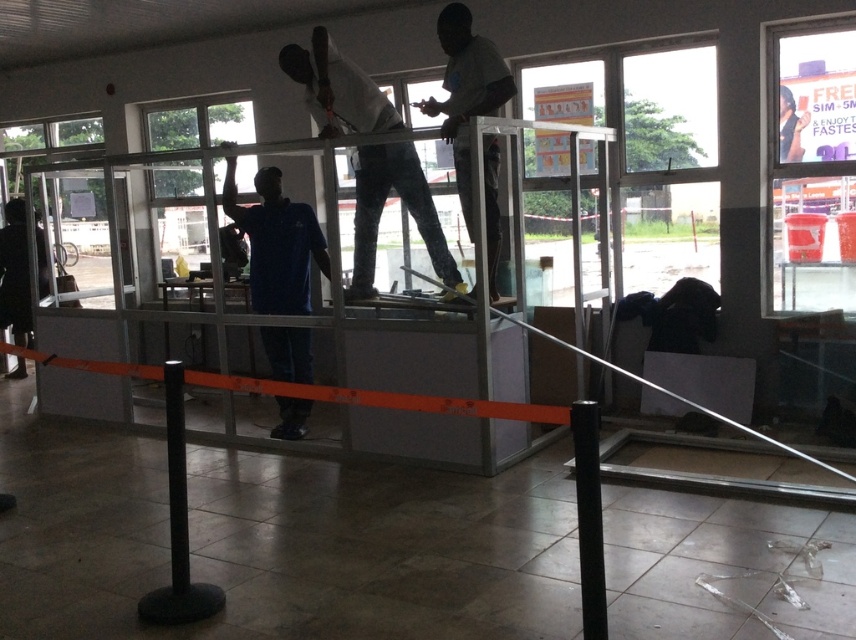
Is transparent glass window at upper right positioned at the back of white matte shirt at upper center?

Yes, it is behind white matte shirt at upper center.

At what (x,y) coordinates should I click in order to perform the action: click on transparent glass window at upper right. Please return your answer as a coordinate pair (x, y). The width and height of the screenshot is (856, 640). Looking at the image, I should click on (811, 164).

You are a GUI agent. You are given a task and a screenshot of the screen. Output one action in this format:
    pyautogui.click(x=<x>, y=<y>)
    Task: Click on the transparent glass window at upper right
    The width and height of the screenshot is (856, 640).
    Given the screenshot: What is the action you would take?
    pyautogui.click(x=811, y=164)

Who is positioned more to the left, light blue shirt at center or white matte shirt at upper center?

From the viewer's perspective, light blue shirt at center appears more on the left side.

What are the coordinates of `light blue shirt at center` in the screenshot? It's located at (381, 211).

The width and height of the screenshot is (856, 640). Describe the element at coordinates (381, 211) in the screenshot. I see `light blue shirt at center` at that location.

Where is `light blue shirt at center`? The width and height of the screenshot is (856, 640). light blue shirt at center is located at coordinates (381, 211).

Based on the photo, does white matte shirt at upper center appear on the left side of black rubber pole at lower left?

In fact, white matte shirt at upper center is to the right of black rubber pole at lower left.

Which is behind, point (495, 102) or point (169, 422)?

The point (495, 102) is behind.

The width and height of the screenshot is (856, 640). Identify the location of white matte shirt at upper center. (467, 92).